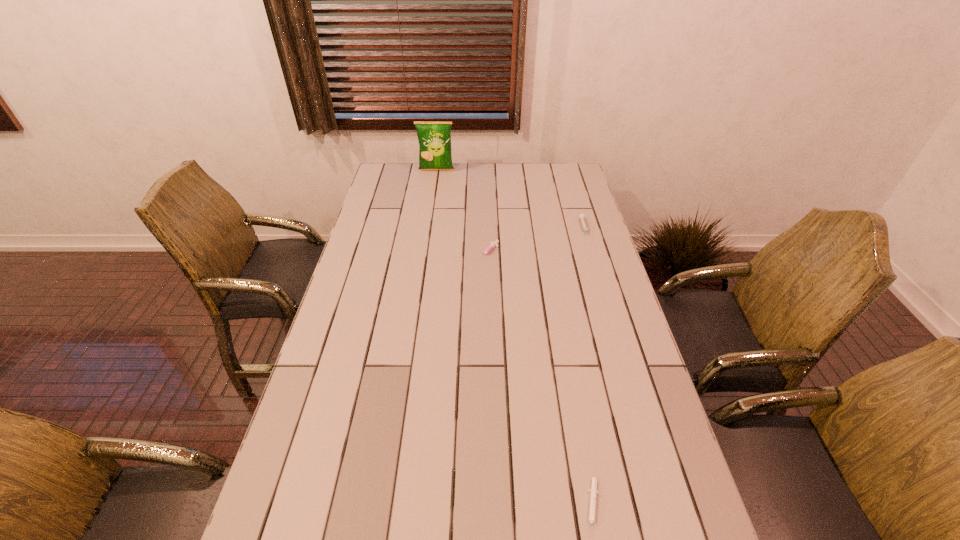
Where is `crisp (potato chip)`? crisp (potato chip) is located at coordinates (434, 138).

Where is `the tallest object`? the tallest object is located at coordinates (434, 138).

The width and height of the screenshot is (960, 540). I want to click on the farthest syringe, so click(581, 216).

Identify the location of the rightmost object. (581, 216).

I want to click on the third object from right to left, so click(492, 245).

At what (x,y) coordinates should I click in order to perform the action: click on the second nearest syringe. Please return your answer as a coordinate pair (x, y). The image size is (960, 540). Looking at the image, I should click on (492, 245).

The image size is (960, 540). What are the coordinates of `vacant space situated 0.080m on the front-facing side of the farthest object` in the screenshot? It's located at [x=435, y=183].

Locate an element on the screen. This screenshot has width=960, height=540. vacant space situated at the needle end of the second farthest object is located at coordinates (607, 302).

Locate an element on the screen. This screenshot has height=540, width=960. free region located 0.250m on the right of the second object from left to right is located at coordinates (569, 253).

Where is `object present at the far edge`? The width and height of the screenshot is (960, 540). object present at the far edge is located at coordinates click(x=434, y=138).